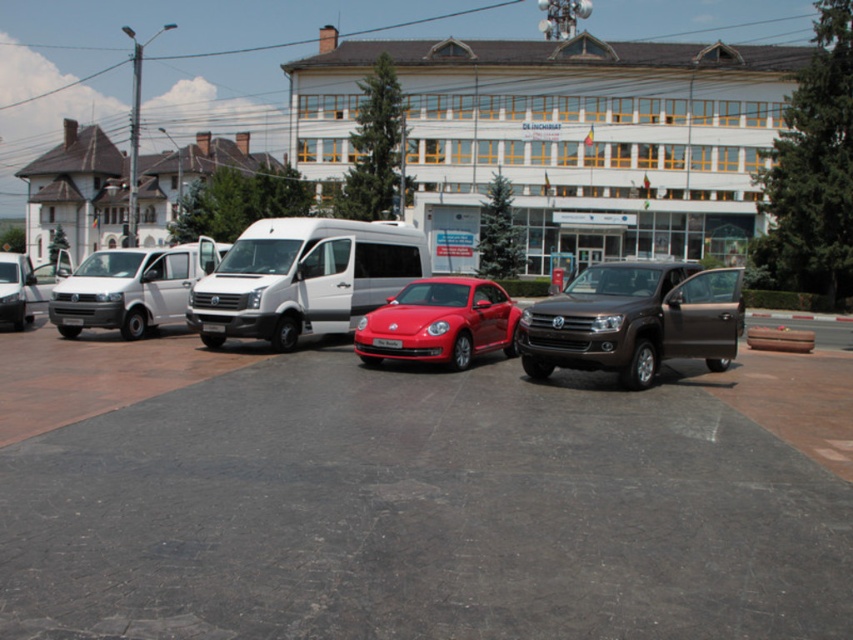
Where is `satin brown suv at center`? The height and width of the screenshot is (640, 853). satin brown suv at center is located at coordinates (634, 321).

Looking at this image, does satin brown suv at center come in front of white matte van at left?

Yes.

Between point (582, 317) and point (140, 289), which one is positioned behind?

Point (140, 289)

The image size is (853, 640). In order to click on satin brown suv at center in this screenshot , I will do `click(634, 321)`.

Does white plastic license plate at center have a greater height compared to black plastic license plate at center?

In fact, white plastic license plate at center may be shorter than black plastic license plate at center.

Does white plastic license plate at center appear over black plastic license plate at center?

Incorrect, white plastic license plate at center is not positioned above black plastic license plate at center.

Locate an element on the screen. white plastic license plate at center is located at coordinates (386, 342).

This screenshot has width=853, height=640. I want to click on white plastic license plate at center, so click(386, 342).

Between glossy red car at center and white matte van at left, which one has less height?

With less height is glossy red car at center.

Does glossy red car at center appear over white matte van at left?

Actually, glossy red car at center is below white matte van at left.

Which is behind, point (386, 308) or point (177, 260)?

Positioned behind is point (177, 260).

Where is `glossy red car at center`? glossy red car at center is located at coordinates (440, 323).